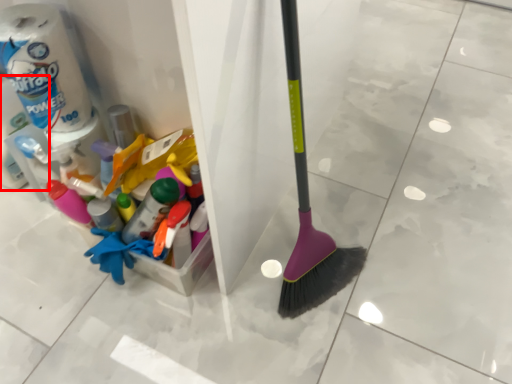
Question: From the image's perspective, where is toilet paper (annotated by the red box) located in relation to toilet paper in the image?

Choices:
 (A) above
 (B) below

Answer: (B)